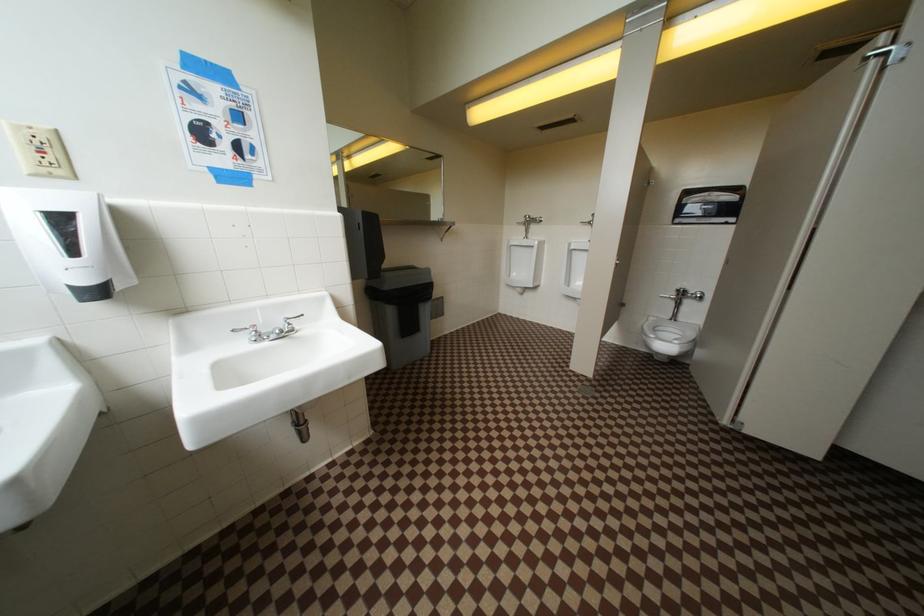
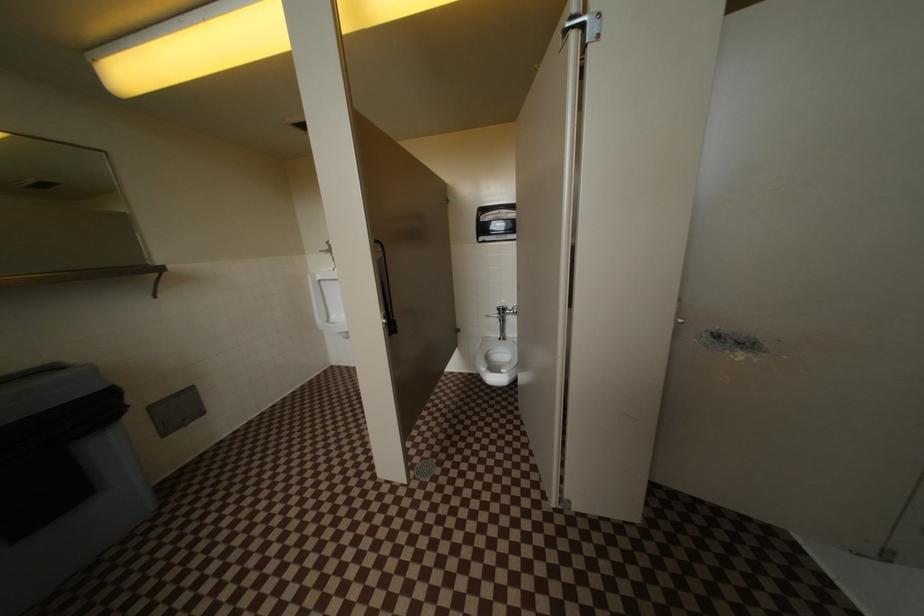
Question: The camera is either moving clockwise (left) or counter-clockwise (right) around the object. The first image is from the beginning of the video and the second image is from the end. Is the camera moving left or right when shooting the video?

Choices:
 (A) Left
 (B) Right

Answer: (A)